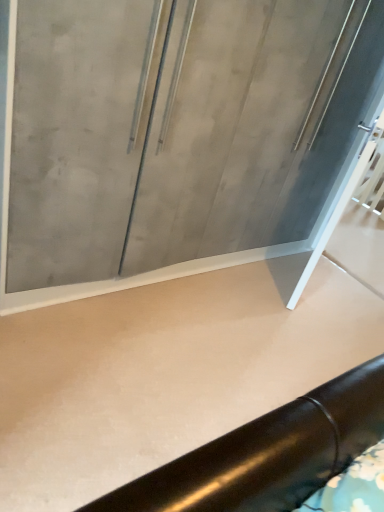
Question: Can you confirm if smooth concrete at center is taller than matte gray glass door at center?

Choices:
 (A) yes
 (B) no

Answer: (B)

Question: Is smooth concrete at center wider than matte gray glass door at center?

Choices:
 (A) no
 (B) yes

Answer: (B)

Question: Is smooth concrete at center with matte gray glass door at center?

Choices:
 (A) no
 (B) yes

Answer: (A)

Question: Can you confirm if smooth concrete at center is bigger than matte gray glass door at center?

Choices:
 (A) yes
 (B) no

Answer: (B)

Question: From a real-world perspective, is smooth concrete at center positioned under matte gray glass door at center based on gravity?

Choices:
 (A) no
 (B) yes

Answer: (B)

Question: Can you confirm if smooth concrete at center is thinner than matte gray glass door at center?

Choices:
 (A) yes
 (B) no

Answer: (B)

Question: Is matte gray glass door at center smaller than smooth concrete at center?

Choices:
 (A) yes
 (B) no

Answer: (B)

Question: Is matte gray glass door at center positioned before smooth concrete at center?

Choices:
 (A) no
 (B) yes

Answer: (A)

Question: Is matte gray glass door at center at the left side of smooth concrete at center?

Choices:
 (A) yes
 (B) no

Answer: (A)

Question: Is matte gray glass door at center touching smooth concrete at center?

Choices:
 (A) yes
 (B) no

Answer: (B)

Question: From a real-world perspective, is matte gray glass door at center below smooth concrete at center?

Choices:
 (A) no
 (B) yes

Answer: (A)

Question: Can you confirm if matte gray glass door at center is thinner than smooth concrete at center?

Choices:
 (A) yes
 (B) no

Answer: (A)

Question: From a real-world perspective, is matte gray glass door at center physically located above or below smooth concrete at center?

Choices:
 (A) below
 (B) above

Answer: (B)